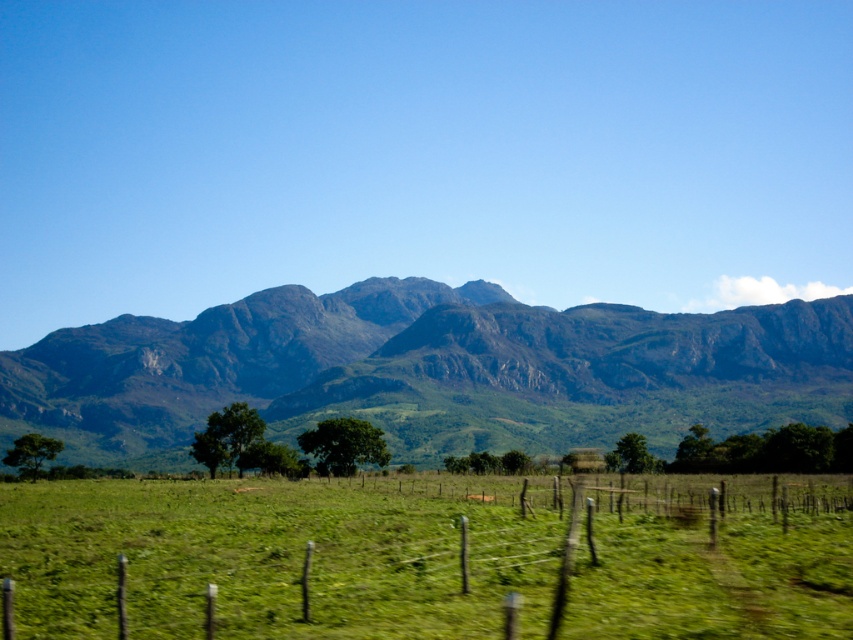
Looking at this image, who is positioned more to the left, green grassy field at center or green textured mountain range at center?

green grassy field at center is more to the left.

Does point (395, 516) lie in front of point (463, 288)?

Yes.

Is point (279, 554) positioned behind point (543, 433)?

No, it is in front of (543, 433).

I want to click on green grassy field at center, so click(x=271, y=560).